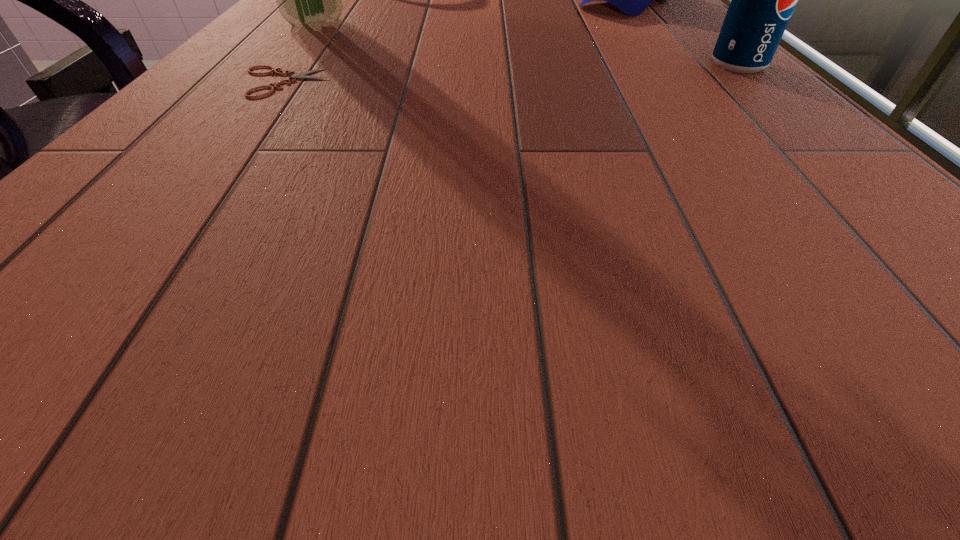
Identify the location of free space on the desktop that is between the shears and the pop and is positioned on the front-facing side of the baseball cap. (501, 73).

Locate an element on the screen. vacant space on the desktop that is between the shortest object and the third shortest object and is positioned on the front-facing side of the bouquet is located at coordinates point(492,74).